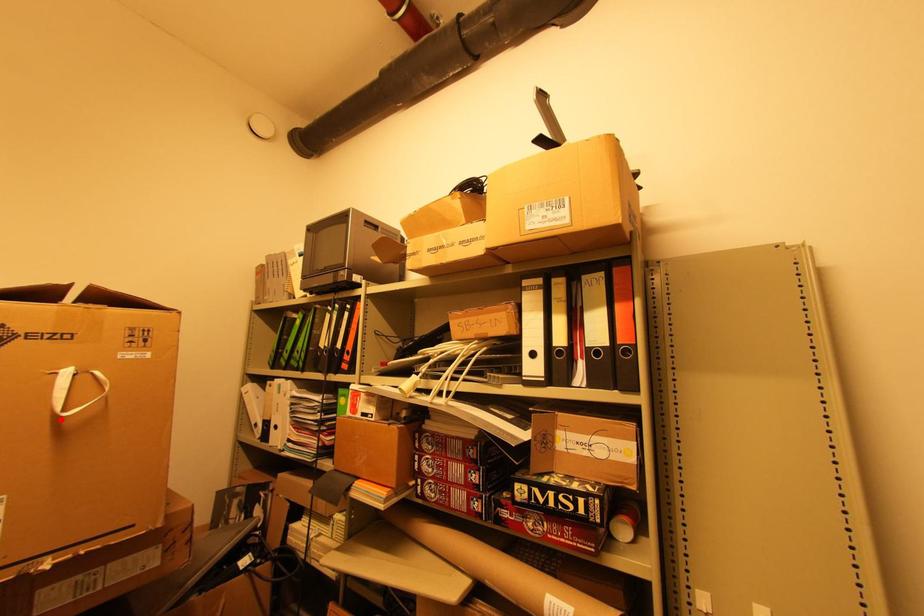
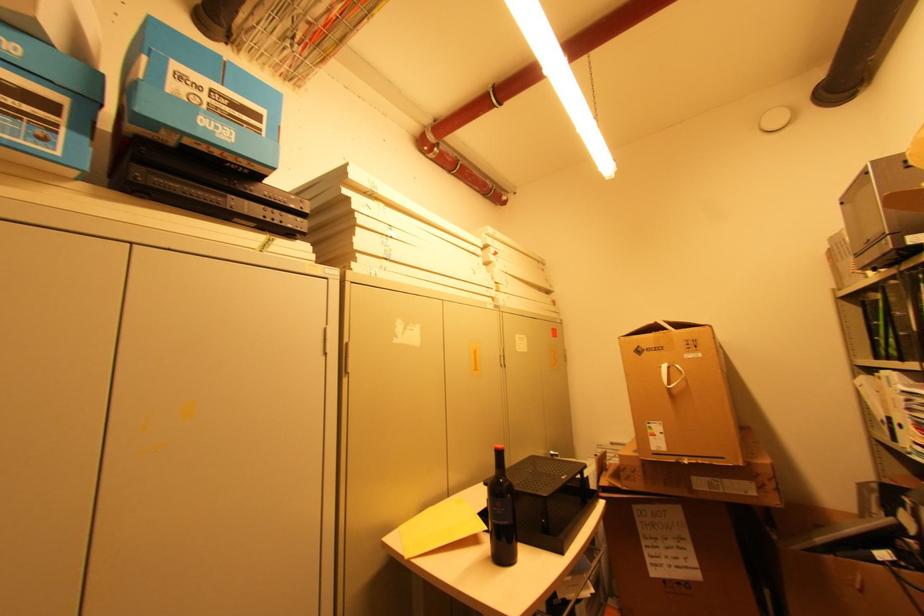
Question: A red point is marked in image1. In image2, is the corresponding 3D point closer to the camera or farther? Reply with the corresponding letter.

Choices:
 (A) The corresponding 3D point is closer.
 (B) The corresponding 3D point is farther.

Answer: (B)